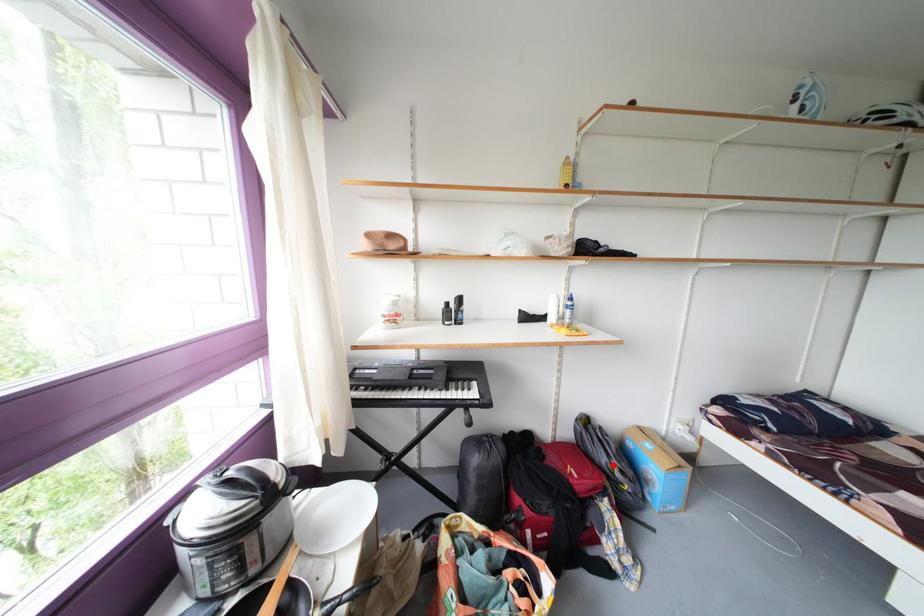
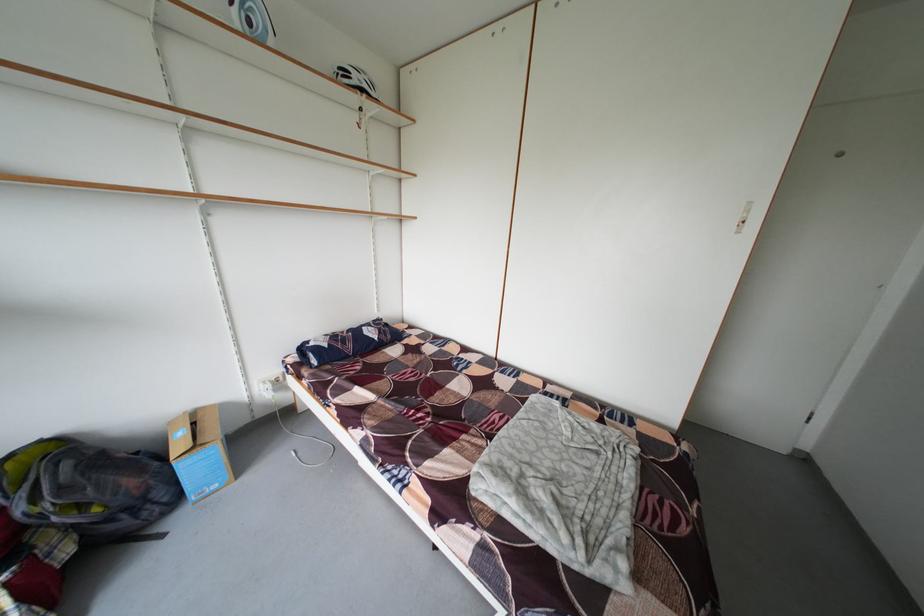
In the second image, find the point that corresponds to the highlighted location in the first image.

(31, 515)